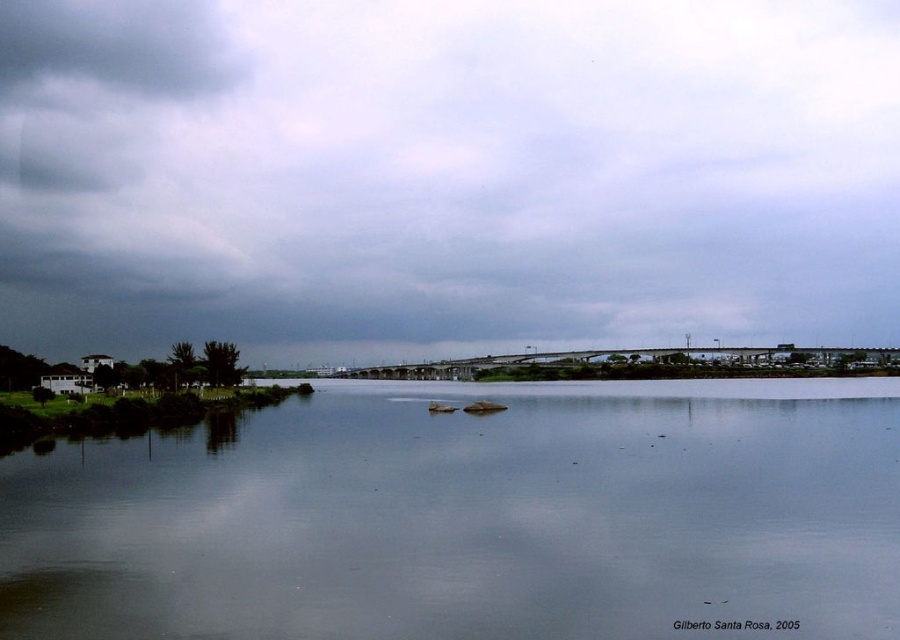
You are standing at the riverside and looking up at the cloudy sky at upper center and the smooth water at center. Which object appears taller from your perspective?

The cloudy sky at upper center appears taller than the smooth water at center.

You are an airplane pilot preparing to land. You notice the cloudy sky at upper center and the dark gray cloud at upper left in your view. Which cloud formation is lower in the sky?

The cloudy sky at upper center is positioned under the dark gray cloud at upper left, meaning the cloudy sky at upper center is lower in the sky than the dark gray cloud at upper left.